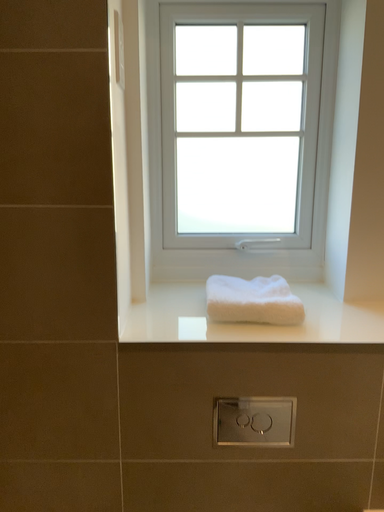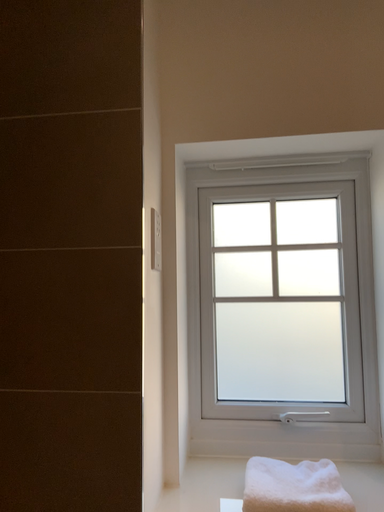
Question: Which way did the camera rotate in the video?

Choices:
 (A) rotated upward
 (B) rotated downward

Answer: (A)